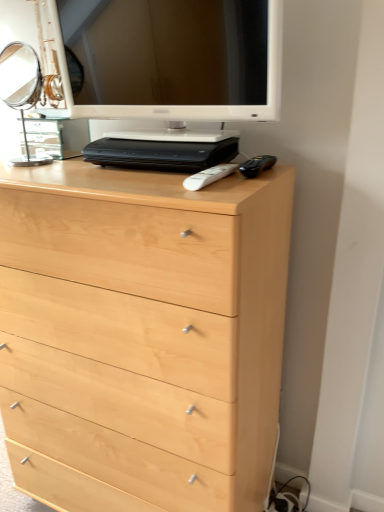
Where is `free space in front of polished silver mirror at upper left`? free space in front of polished silver mirror at upper left is located at coordinates click(x=29, y=173).